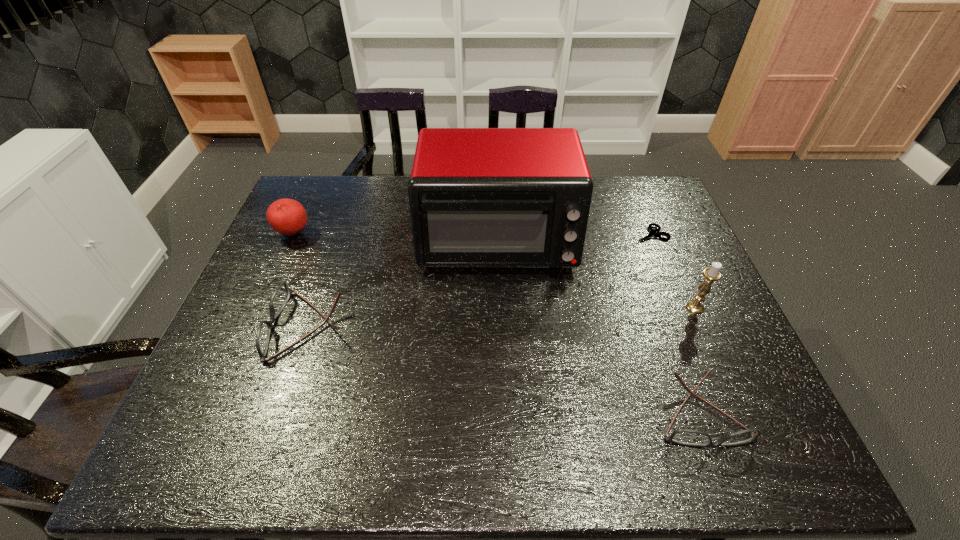
Locate an element on the screen. This screenshot has width=960, height=540. vacant area in the image that satisfies the following two spatial constraints: 1. on the front side of the shortest object; 2. on the right side of the fourth shortest object is located at coordinates (293, 234).